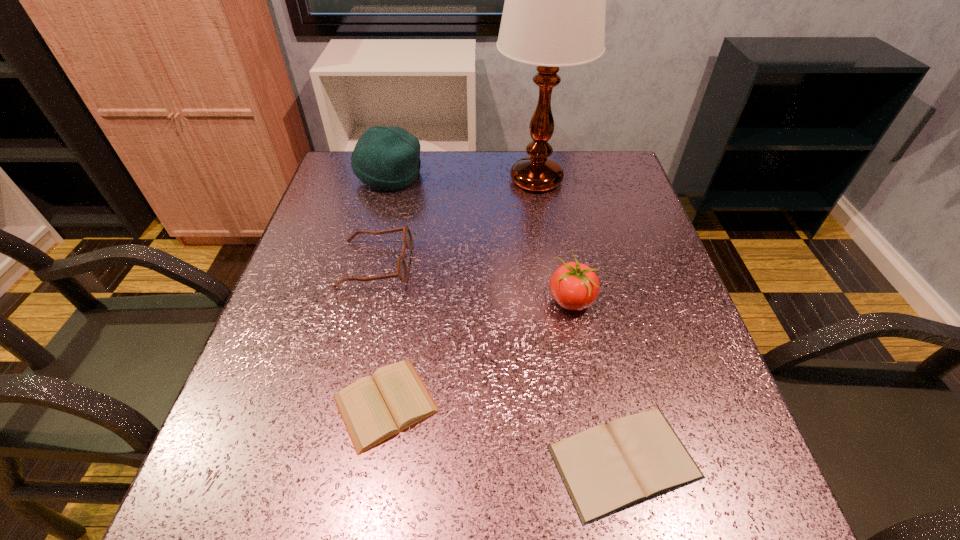
Where is `object at the far right corner`? object at the far right corner is located at coordinates (554, 12).

At what (x,y) coordinates should I click in order to perform the action: click on object that is at the near right corner. Please return your answer as a coordinate pair (x, y). The image size is (960, 540). Looking at the image, I should click on (606, 469).

I want to click on vacant region at the far edge, so (562, 163).

What are the coordinates of `vacant space at the near edge of the desktop` in the screenshot? It's located at (361, 484).

The image size is (960, 540). Identify the location of free space at the left edge of the desktop. (336, 369).

In the image, there is a desktop. Where is `free space at the right edge`? free space at the right edge is located at coordinates (656, 350).

This screenshot has height=540, width=960. What are the coordinates of `vacant region at the far left corner of the desktop` in the screenshot? It's located at (349, 156).

Where is `vacant space at the far right corner`? Image resolution: width=960 pixels, height=540 pixels. vacant space at the far right corner is located at coordinates point(596,176).

What are the coordinates of `vacant area that lies between the tallest object and the diary` in the screenshot? It's located at (461, 292).

At what (x,y) coordinates should I click in order to perform the action: click on vacant space that is in between the beanie and the diary. Please return your answer as a coordinate pair (x, y). The image size is (960, 540). Looking at the image, I should click on (388, 289).